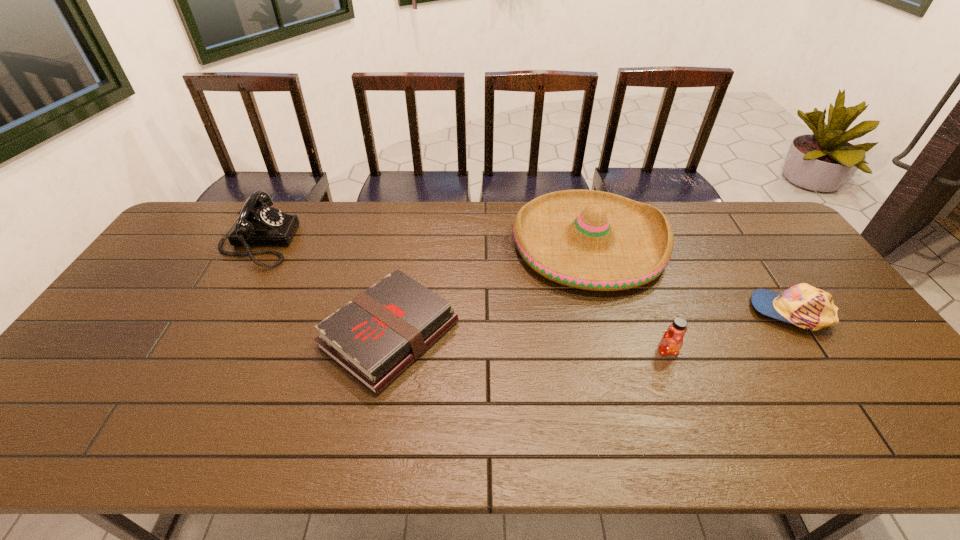
The image size is (960, 540). What are the coordinates of `sombrero` in the screenshot? It's located at (592, 240).

Identify the location of telephone. (259, 224).

This screenshot has height=540, width=960. What are the coordinates of `honey` in the screenshot? It's located at (672, 340).

Where is `cap`? cap is located at coordinates (805, 306).

At what (x,y) coordinates should I click in order to perform the action: click on the second object from left to right. Please return your answer as a coordinate pair (x, y). Looking at the image, I should click on (378, 334).

At what (x,y) coordinates should I click in order to perform the action: click on hardback book. Please return your answer as a coordinate pair (x, y). Looking at the image, I should click on (378, 334).

Where is `vacant area situated on the left of the sombrero`? vacant area situated on the left of the sombrero is located at coordinates (458, 244).

You are a GUI agent. You are given a task and a screenshot of the screen. Output one action in this format:
    pyautogui.click(x=<x>, y=<y>)
    Task: Click on the vacant space located on the dial of the telephone
    This screenshot has height=540, width=960.
    Given the screenshot: What is the action you would take?
    pyautogui.click(x=321, y=242)

Find the location of `blank area located 0.120m on the front label of the honey`. blank area located 0.120m on the front label of the honey is located at coordinates (686, 401).

You are a GUI agent. You are given a task and a screenshot of the screen. Output one action in this format:
    pyautogui.click(x=<x>, y=<y>)
    Task: Click on the vacant space located on the bill of the cap
    Image resolution: width=960 pixels, height=540 pixels.
    Given the screenshot: What is the action you would take?
    pyautogui.click(x=727, y=312)